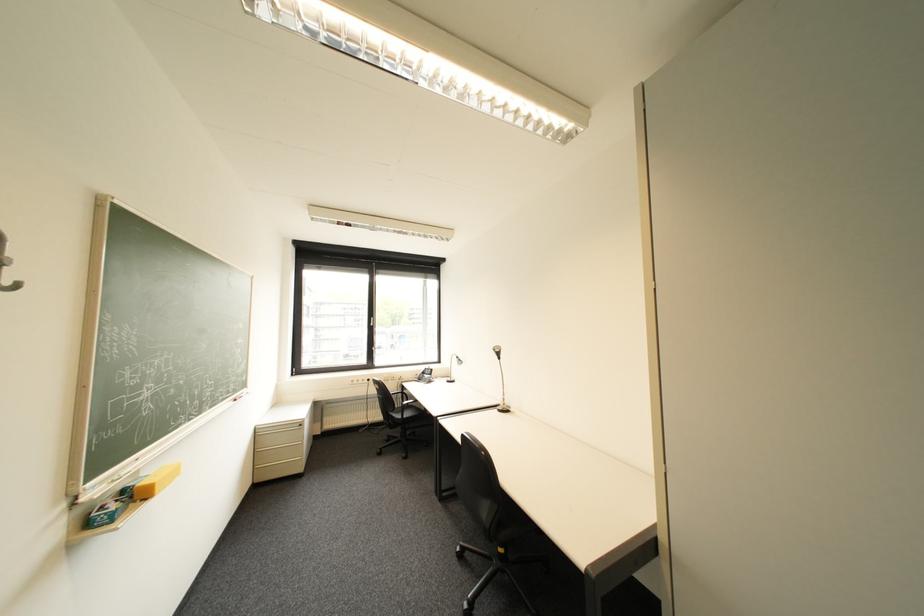
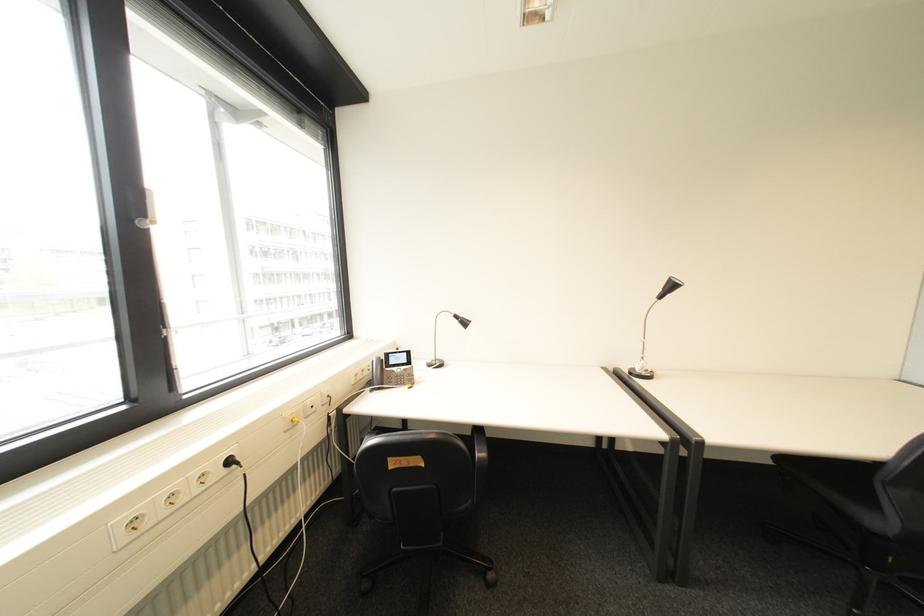
Where in the second image is the point corresponding to point 379,381 from the first image?

(239, 463)